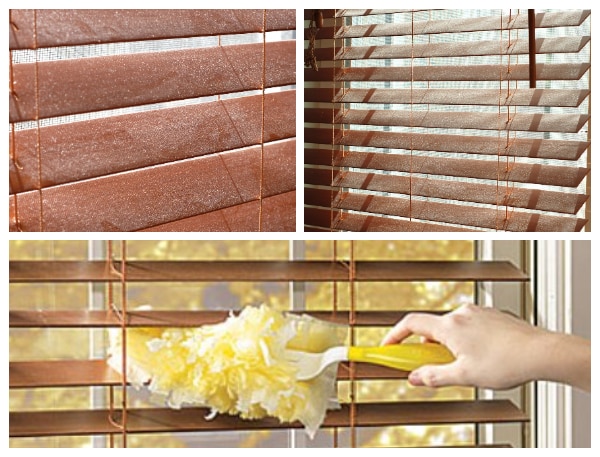
Find the location of a particular element. window is located at coordinates (423, 113).